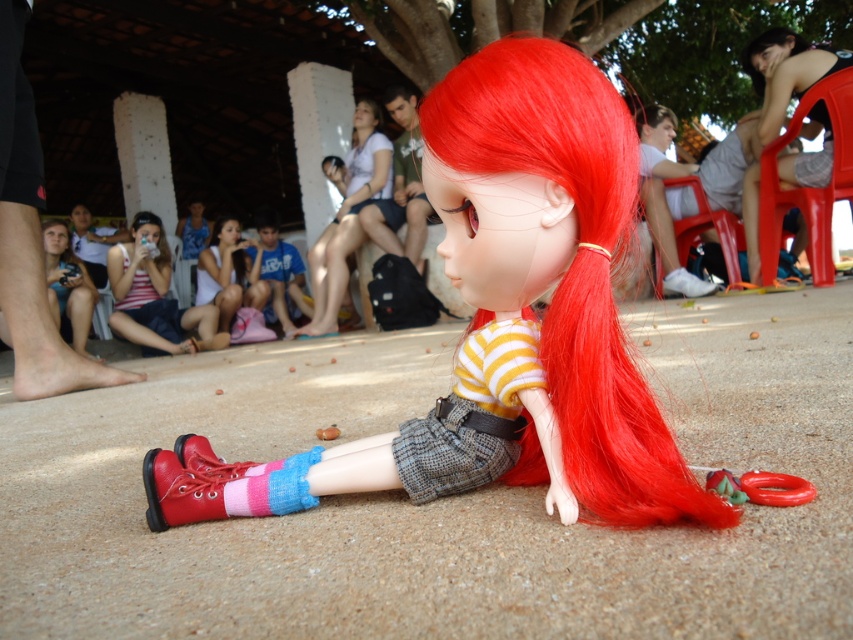
Question: Which object is positioned farthest from the matte white shirt at center?

Choices:
 (A) matte plastic doll at center
 (B) rubberized plastic ring at lower center
 (C) striped cotton shirt at center
 (D) striped cotton sock at lower left

Answer: (B)

Question: Does striped cotton shirt at center appear on the left side of white fabric shoe at lower center?

Choices:
 (A) yes
 (B) no

Answer: (A)

Question: Which point is farther to the camera?

Choices:
 (A) (244, 506)
 (B) (157, 461)

Answer: (B)

Question: Is striped cotton shirt at center smaller than striped cotton sock at lower left?

Choices:
 (A) yes
 (B) no

Answer: (B)

Question: Which point is farther to the camera?

Choices:
 (A) (795, 497)
 (B) (271, 497)
 (C) (190, 461)
 (D) (608, 252)

Answer: (C)

Question: Is matte red boot at lower left below matte white shirt at center?

Choices:
 (A) yes
 (B) no

Answer: (A)